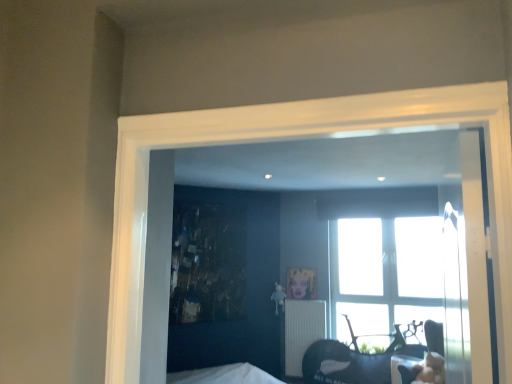
Question: Is metallic gold picture frame at center at the left side of transparent glass window at center?

Choices:
 (A) no
 (B) yes

Answer: (B)

Question: Considering the relative sizes of metallic gold picture frame at center and transparent glass window at center in the image provided, is metallic gold picture frame at center thinner than transparent glass window at center?

Choices:
 (A) yes
 (B) no

Answer: (A)

Question: Is metallic gold picture frame at center oriented away from transparent glass window at center?

Choices:
 (A) yes
 (B) no

Answer: (B)

Question: Is metallic gold picture frame at center bigger than transparent glass window at center?

Choices:
 (A) yes
 (B) no

Answer: (B)

Question: Is metallic gold picture frame at center in contact with transparent glass window at center?

Choices:
 (A) yes
 (B) no

Answer: (B)

Question: Is metallic gold picture frame at center aimed at transparent glass window at center?

Choices:
 (A) yes
 (B) no

Answer: (B)

Question: From a real-world perspective, is metallic gold picture frame at center positioned over white ribbed radiator at center based on gravity?

Choices:
 (A) yes
 (B) no

Answer: (A)

Question: Would you say metallic gold picture frame at center contains white ribbed radiator at center?

Choices:
 (A) no
 (B) yes

Answer: (A)

Question: From the image's perspective, is metallic gold picture frame at center above white ribbed radiator at center?

Choices:
 (A) yes
 (B) no

Answer: (A)

Question: Is metallic gold picture frame at center with white ribbed radiator at center?

Choices:
 (A) no
 (B) yes

Answer: (A)

Question: Considering the relative positions of metallic gold picture frame at center and white ribbed radiator at center in the image provided, is metallic gold picture frame at center in front of white ribbed radiator at center?

Choices:
 (A) no
 (B) yes

Answer: (A)

Question: Can you confirm if metallic gold picture frame at center is shorter than white ribbed radiator at center?

Choices:
 (A) no
 (B) yes

Answer: (B)

Question: Does white ribbed radiator at center come behind metallic gold picture frame at center?

Choices:
 (A) no
 (B) yes

Answer: (A)